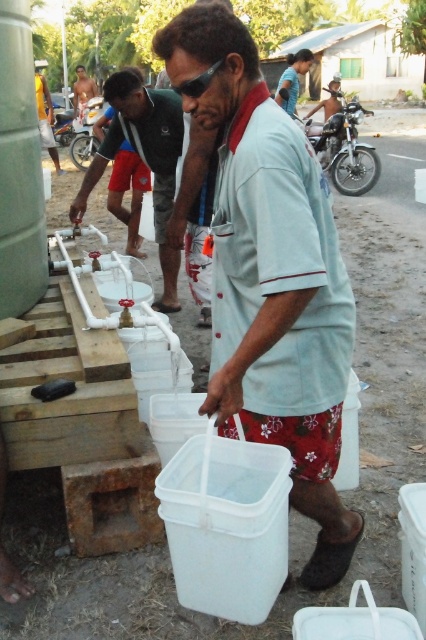
The image size is (426, 640). Describe the element at coordinates (344, 145) in the screenshot. I see `shiny chrome motorcycle at center right` at that location.

Can you confirm if shiny chrome motorcycle at center right is thinner than yellow shirt at center?

In fact, shiny chrome motorcycle at center right might be wider than yellow shirt at center.

Image resolution: width=426 pixels, height=640 pixels. Describe the element at coordinates (344, 145) in the screenshot. I see `shiny chrome motorcycle at center right` at that location.

The image size is (426, 640). What are the coordinates of `shiny chrome motorcycle at center right` in the screenshot? It's located at (344, 145).

Between brushed metal motorcycle at center and yellow shirt at center, which one has more height?

brushed metal motorcycle at center is taller.

Which is below, brushed metal motorcycle at center or yellow shirt at center?

yellow shirt at center

Which is in front, point (74, 156) or point (37, 102)?

Point (37, 102)

The width and height of the screenshot is (426, 640). I want to click on brushed metal motorcycle at center, so click(86, 134).

Can you confirm if shiny chrome motorcycle at center right is thinner than brushed metal motorcycle at center?

Yes, shiny chrome motorcycle at center right is thinner than brushed metal motorcycle at center.

This screenshot has width=426, height=640. Describe the element at coordinates (344, 145) in the screenshot. I see `shiny chrome motorcycle at center right` at that location.

Is point (348, 148) farther from viewer compared to point (92, 129)?

No, (348, 148) is closer to viewer.

Locate an element on the screen. The width and height of the screenshot is (426, 640). shiny chrome motorcycle at center right is located at coordinates (344, 145).